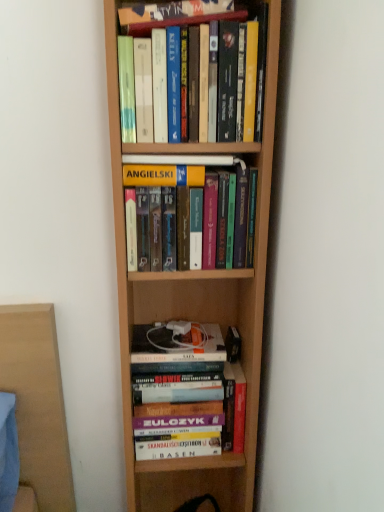
What is the approximate height of hardcover books at upper center, the third book positioned from the bottom?

It is 8.53 inches.

Measure the distance between hardcover books at center, marked as the second book in a bottom-to-top arrangement, and camera.

hardcover books at center, marked as the second book in a bottom-to-top arrangement, and camera are 31.22 inches apart.

Measure the distance between wooden bookshelf at lower center and camera.

wooden bookshelf at lower center is 1.00 meters away from camera.

Find the location of a particular element. hardcover books at upper center, the third book positioned from the bottom is located at coordinates (198, 71).

Considering the relative positions of hardcover books at upper center, the third book positioned from the bottom, and hardcover book at upper center, positioned as the first book in top-to-bottom order, in the image provided, is hardcover books at upper center, the third book positioned from the bottom, to the left of hardcover book at upper center, positioned as the first book in top-to-bottom order, from the viewer's perspective?

In fact, hardcover books at upper center, the third book positioned from the bottom, is to the right of hardcover book at upper center, positioned as the first book in top-to-bottom order.

Which is correct: hardcover books at upper center, the 2th book viewed from the top, is inside hardcover book at upper center, positioned as the first book in top-to-bottom order, or outside of it?

The correct answer is: outside.

Based on the photo, is hardcover books at upper center, the 2th book viewed from the top, smaller than hardcover book at upper center, positioned as the first book in top-to-bottom order?

Incorrect, hardcover books at upper center, the 2th book viewed from the top, is not smaller in size than hardcover book at upper center, positioned as the first book in top-to-bottom order.

Is hardcover books at upper center, the 2th book viewed from the top, far away from hardcover book at upper center, positioned as the first book in top-to-bottom order?

Actually, hardcover books at upper center, the 2th book viewed from the top, and hardcover book at upper center, positioned as the first book in top-to-bottom order, are a little close together.

Does wooden bookshelf at lower center have a lesser width compared to hardcover books at center, the 1th book when ordered from bottom to top?

No.

Considering the sizes of objects wooden bookshelf at lower center and hardcover books at center, the 1th book when ordered from bottom to top, in the image provided, who is shorter, wooden bookshelf at lower center or hardcover books at center, the 1th book when ordered from bottom to top,?

wooden bookshelf at lower center is shorter.

From the image's perspective, between wooden bookshelf at lower center and hardcover books at center, which ranks as the 4th book in top-to-bottom order, who is located below?

wooden bookshelf at lower center appears lower in the image.

What are the coordinates of `book that is the 1st object above the wooden bookshelf at lower center (from a real-world perspective)` in the screenshot? It's located at (186, 394).

From a real-world perspective, is hardcover books at upper center, the 2th book viewed from the top, physically above hardcover books at center, marked as the second book in a bottom-to-top arrangement?

Indeed, from a real-world perspective, hardcover books at upper center, the 2th book viewed from the top, stands above hardcover books at center, marked as the second book in a bottom-to-top arrangement.

From the picture: Which point is more forward, (195, 70) or (128, 176)?

Positioned in front is point (195, 70).

Measure the distance between hardcover books at upper center, the third book positioned from the bottom, and hardcover books at center, marked as the second book in a bottom-to-top arrangement.

The distance of hardcover books at upper center, the third book positioned from the bottom, from hardcover books at center, marked as the second book in a bottom-to-top arrangement, is 5.00 inches.

Would you say hardcover books at center, marked as the second book in a bottom-to-top arrangement, is part of hardcover books at upper center, the 2th book viewed from the top,'s contents?

Actually, hardcover books at center, marked as the second book in a bottom-to-top arrangement, is outside hardcover books at upper center, the 2th book viewed from the top.

In the image, is hardcover books at center, marked as the second book in a bottom-to-top arrangement, positioned in front of or behind hardcover books at center, which ranks as the 4th book in top-to-bottom order?

hardcover books at center, marked as the second book in a bottom-to-top arrangement, is in front of hardcover books at center, which ranks as the 4th book in top-to-bottom order.

Can you confirm if hardcover books at center, marked as the second book in a bottom-to-top arrangement, is smaller than hardcover books at center, which ranks as the 4th book in top-to-bottom order?

Indeed, hardcover books at center, marked as the second book in a bottom-to-top arrangement, has a smaller size compared to hardcover books at center, which ranks as the 4th book in top-to-bottom order.

Is hardcover books at center, which is the third book from top to bottom, beside hardcover books at center, which ranks as the 4th book in top-to-bottom order?

hardcover books at center, which is the third book from top to bottom, and hardcover books at center, which ranks as the 4th book in top-to-bottom order, are not in contact.

What's the angular difference between hardcover books at center, the 1th book when ordered from bottom to top, and wooden bookshelf at lower center's facing directions?

hardcover books at center, the 1th book when ordered from bottom to top, and wooden bookshelf at lower center are facing 0.0256 degrees away from each other.

Would you say hardcover books at center, which ranks as the 4th book in top-to-bottom order, contains wooden bookshelf at lower center?

That's incorrect, wooden bookshelf at lower center is not inside hardcover books at center, which ranks as the 4th book in top-to-bottom order.

Does hardcover books at center, the 1th book when ordered from bottom to top, turn towards wooden bookshelf at lower center?

No, hardcover books at center, the 1th book when ordered from bottom to top, is not facing towards wooden bookshelf at lower center.

Which point is more distant from viewer, (208, 446) or (212, 158)?

The point (208, 446) is farther from the camera.

Which object is closer to the camera, hardcover books at center, which ranks as the 4th book in top-to-bottom order, or hardcover books at center, marked as the second book in a bottom-to-top arrangement?

hardcover books at center, marked as the second book in a bottom-to-top arrangement, is closer to the camera.

From a real-world perspective, is hardcover books at center, the 1th book when ordered from bottom to top, physically above hardcover books at center, marked as the second book in a bottom-to-top arrangement?

No, from a real-world perspective, hardcover books at center, the 1th book when ordered from bottom to top, is not on top of hardcover books at center, marked as the second book in a bottom-to-top arrangement.

Between hardcover books at center, which ranks as the 4th book in top-to-bottom order, and hardcover books at center, which is the third book from top to bottom, which one has less height?

hardcover books at center, which is the third book from top to bottom.

Is point (174, 182) positioned before point (164, 486)?

Yes, point (174, 182) is closer to viewer.

Based on the photo, does hardcover books at center, marked as the second book in a bottom-to-top arrangement, have a greater height compared to wooden bookshelf at lower center?

No.

From a real-world perspective, is hardcover books at center, which is the third book from top to bottom, below wooden bookshelf at lower center?

No, from a real-world perspective, hardcover books at center, which is the third book from top to bottom, is not beneath wooden bookshelf at lower center.

Where is `book above the hardcover books at upper center, the third book positioned from the bottom (from the image's perspective)`? This screenshot has width=384, height=512. book above the hardcover books at upper center, the third book positioned from the bottom (from the image's perspective) is located at coordinates (173, 11).

The height and width of the screenshot is (512, 384). What are the coordinates of `shelf below the hardcover books at center, which ranks as the 4th book in top-to-bottom order (from the image's perspective)` in the screenshot? It's located at (190, 482).

In the scene shown: From the image, which object appears to be farther from hardcover book at upper center, positioned as the first book in top-to-bottom order, hardcover books at center, the 1th book when ordered from bottom to top, or hardcover books at upper center, the third book positioned from the bottom?

hardcover books at center, the 1th book when ordered from bottom to top, is further to hardcover book at upper center, positioned as the first book in top-to-bottom order.

Looking at the image, which one is located closer to wooden bookshelf at lower center, hardcover book at upper center, which is the fourth book in bottom-to-top order, or hardcover books at upper center, the 2th book viewed from the top?

hardcover books at upper center, the 2th book viewed from the top, is positioned closer to the anchor wooden bookshelf at lower center.

Considering their positions, is hardcover books at upper center, the third book positioned from the bottom, positioned closer to hardcover books at center, which is the third book from top to bottom, than hardcover books at center, which ranks as the 4th book in top-to-bottom order?

hardcover books at upper center, the third book positioned from the bottom.

Looking at the image, which one is located closer to wooden bookshelf at lower center, hardcover books at center, which is the third book from top to bottom, or hardcover books at center, which ranks as the 4th book in top-to-bottom order?

Based on the image, hardcover books at center, which ranks as the 4th book in top-to-bottom order, appears to be nearer to wooden bookshelf at lower center.

Estimate the real-world distances between objects in this image. Which object is further from hardcover books at upper center, the third book positioned from the bottom, hardcover books at center, the 1th book when ordered from bottom to top, or wooden bookshelf at lower center?

The object further to hardcover books at upper center, the third book positioned from the bottom, is wooden bookshelf at lower center.

Estimate the real-world distances between objects in this image. Which object is further from hardcover books at upper center, the third book positioned from the bottom, hardcover books at center, which is the third book from top to bottom, or hardcover book at upper center, positioned as the first book in top-to-bottom order?

hardcover books at center, which is the third book from top to bottom, is positioned further to the anchor hardcover books at upper center, the third book positioned from the bottom.

Which object lies further to the anchor point hardcover books at center, which is the third book from top to bottom, wooden bookshelf at lower center or hardcover books at upper center, the 2th book viewed from the top?

wooden bookshelf at lower center.

Looking at the image, which one is located further to hardcover books at center, marked as the second book in a bottom-to-top arrangement, hardcover book at upper center, positioned as the first book in top-to-bottom order, or hardcover books at center, the 1th book when ordered from bottom to top?

Among the two, hardcover books at center, the 1th book when ordered from bottom to top, is located further to hardcover books at center, marked as the second book in a bottom-to-top arrangement.

The image size is (384, 512). Identify the location of book between hardcover book at upper center, positioned as the first book in top-to-bottom order, and hardcover books at center, which is the third book from top to bottom, vertically. (198, 71).

Image resolution: width=384 pixels, height=512 pixels. I want to click on book between hardcover books at center, marked as the second book in a bottom-to-top arrangement, and wooden bookshelf at lower center, in the vertical direction, so click(x=186, y=394).

Locate an element on the screen. This screenshot has width=384, height=512. book between hardcover books at upper center, the third book positioned from the bottom, and hardcover books at center, which ranks as the 4th book in top-to-bottom order, in the vertical direction is located at coordinates (172, 168).